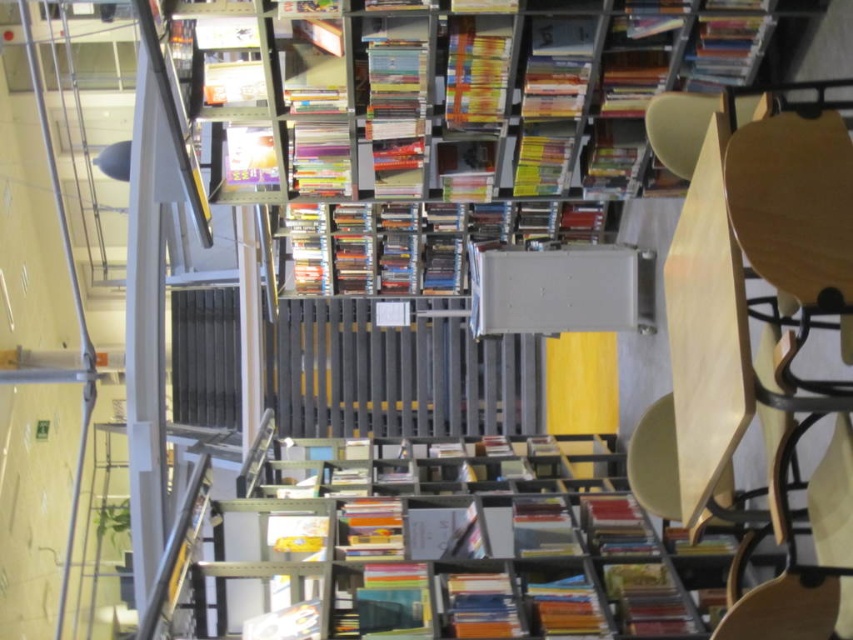
You are standing at the entrance of the library and want to place a new poster on the wall. The poster is meant to be visible from the wooden chair at right. Where should you place the poster relative to the white paper at upper center?

The wooden chair at right is in front of the white paper at upper center, so placing the poster behind the white paper at upper center would make it visible to someone sitting in the wooden chair at right.

You are a librarian who needs to retrieve the white paper at upper center and the orange matte book at center. Based on their positions, which item should you reach for first without moving your current position?

The white paper at upper center should be reached for first because it is located above the orange matte book at center, so you can grab it first before reaching down for the book.